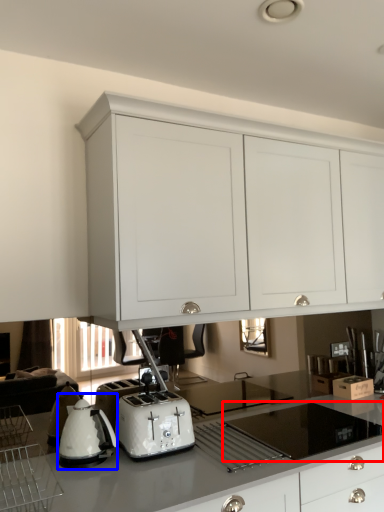
Question: Which point is closer to the camera, gas stove (highlighted by a red box) or home appliance (highlighted by a blue box)?

Choices:
 (A) gas stove
 (B) home appliance

Answer: (A)